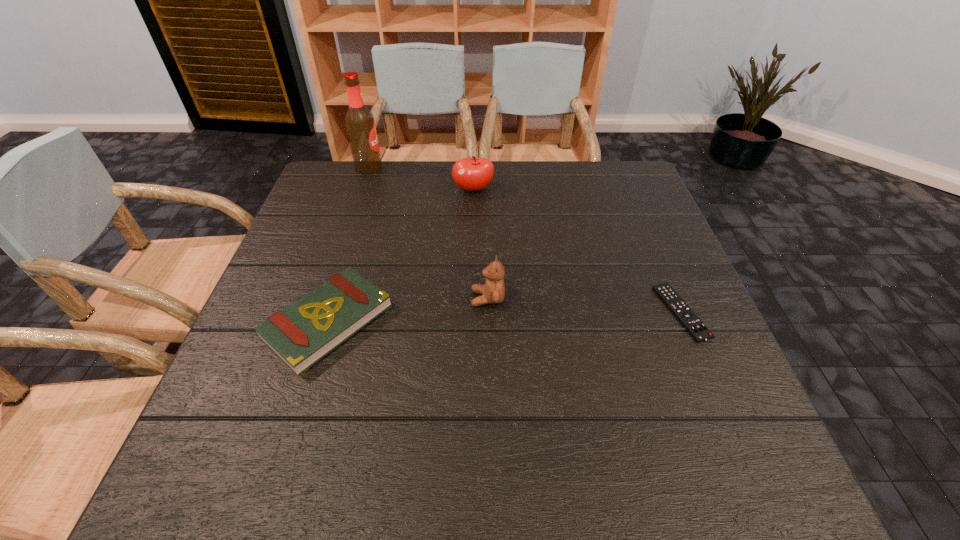
Locate an element on the screen. This screenshot has height=540, width=960. free location that satisfies the following two spatial constraints: 1. on the front side of the book; 2. on the left side of the farthest object is located at coordinates (318, 321).

The image size is (960, 540). In order to click on vacant space that satisfies the following two spatial constraints: 1. on the face of the teddy bear; 2. on the back side of the shortest object in this screenshot , I will do tap(488, 312).